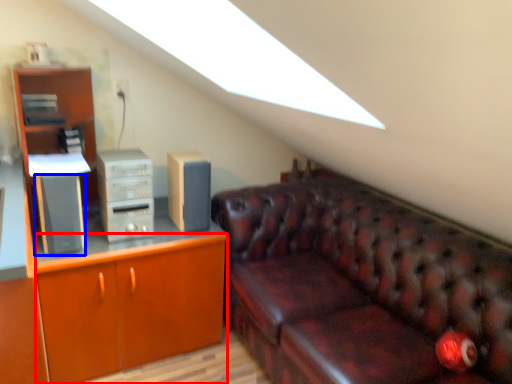
Question: Which of the following is the farthest to the observer, cabinetry (highlighted by a red box) or speaker (highlighted by a blue box)?

Choices:
 (A) cabinetry
 (B) speaker

Answer: (A)